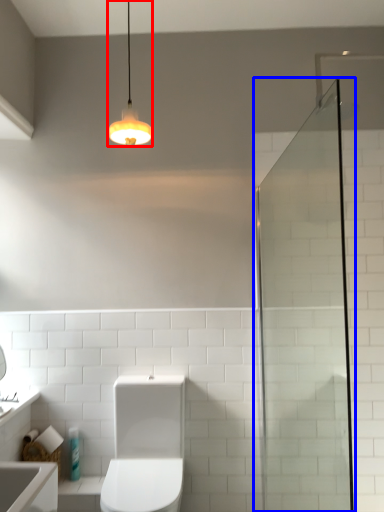
Question: Which object appears closest to the camera in this image, light fixture (highlighted by a red box) or screen door (highlighted by a blue box)?

Choices:
 (A) light fixture
 (B) screen door

Answer: (B)